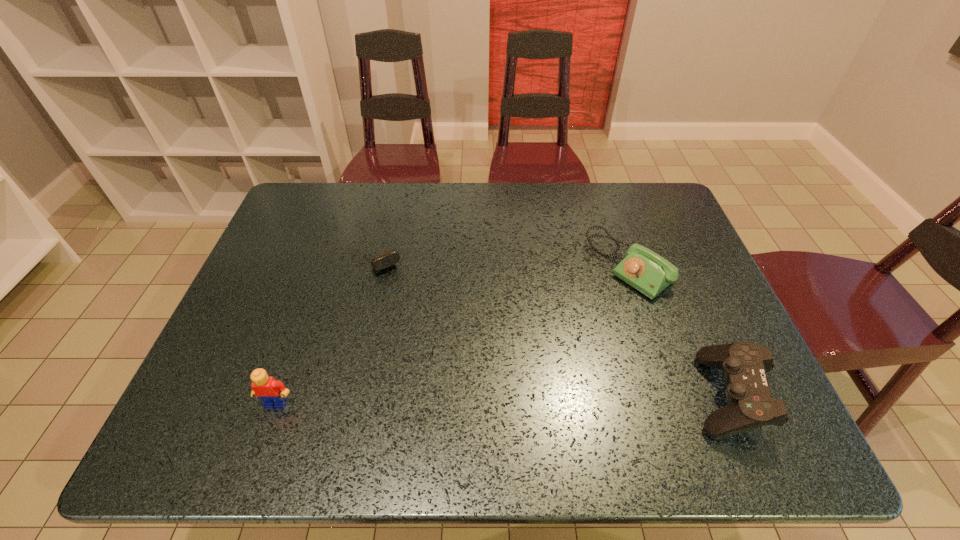
This screenshot has height=540, width=960. Identify the location of free space on the desktop that is between the tallest object and the control and is positioned on the front-facing side of the third object from right to left. (483, 399).

In order to click on free space on the desktop that is between the tallest object and the second tallest object and is positioned on the dial of the second shortest object in this screenshot , I will do `click(449, 400)`.